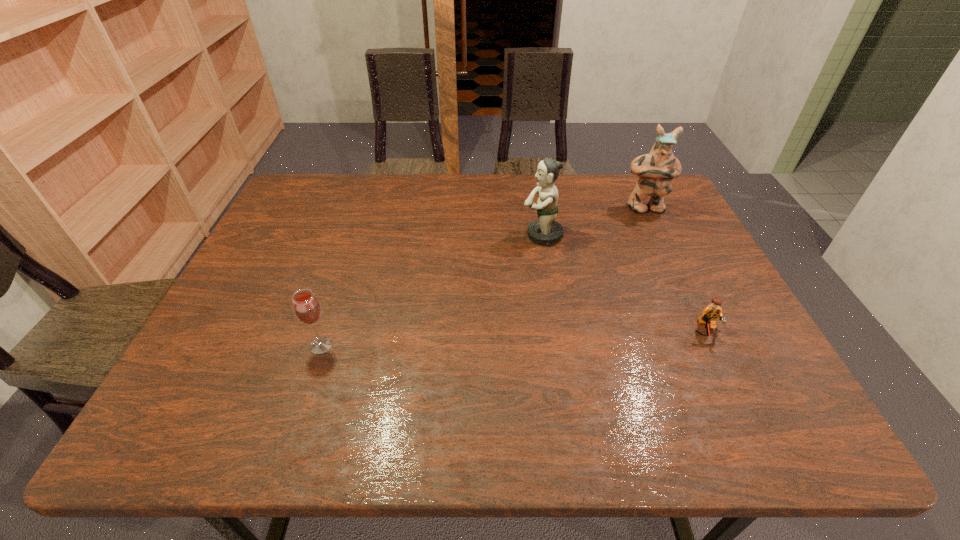
In order to click on vacant space located 0.120m on the front-facing side of the second object from left to right in this screenshot , I will do `click(479, 235)`.

Identify the location of vacant space positioned on the right of the leftmost object. The height and width of the screenshot is (540, 960). (362, 345).

Identify the location of free space located holding a crossbow in the hands of the shortest object. (723, 366).

Find the location of a particular element. Image resolution: width=960 pixels, height=540 pixels. object located at the far edge is located at coordinates (655, 170).

Locate an element on the screen. The image size is (960, 540). figurine that is at the right edge is located at coordinates (655, 170).

Locate an element on the screen. The width and height of the screenshot is (960, 540). Lego located at the right edge is located at coordinates (709, 315).

Locate an element on the screen. This screenshot has width=960, height=540. object located in the far right corner section of the desktop is located at coordinates (655, 170).

This screenshot has width=960, height=540. In the image, there is a desktop. In order to click on vacant region at the far edge in this screenshot , I will do `click(501, 203)`.

Locate an element on the screen. This screenshot has width=960, height=540. vacant space at the near edge of the desktop is located at coordinates (656, 432).

Locate an element on the screen. vacant space at the left edge of the desktop is located at coordinates (265, 236).